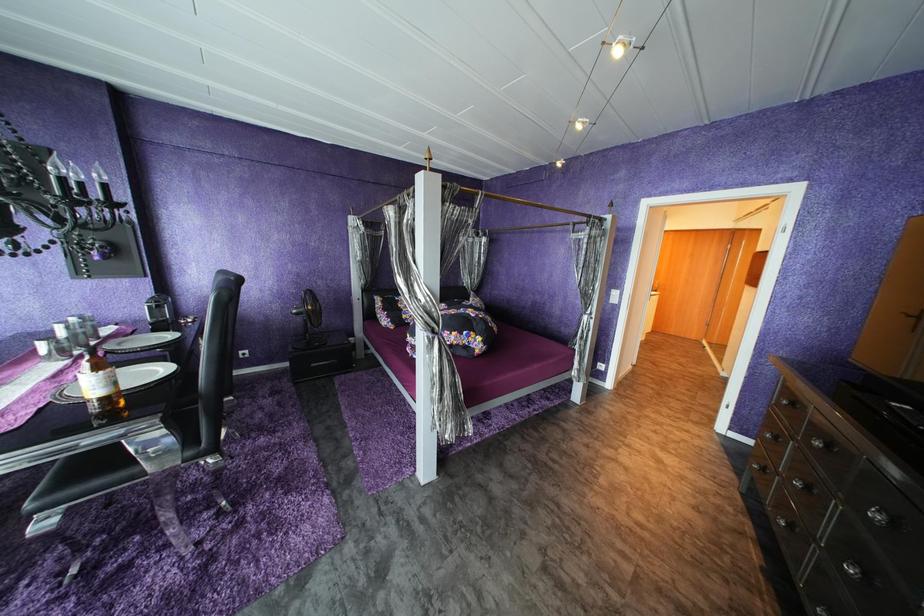
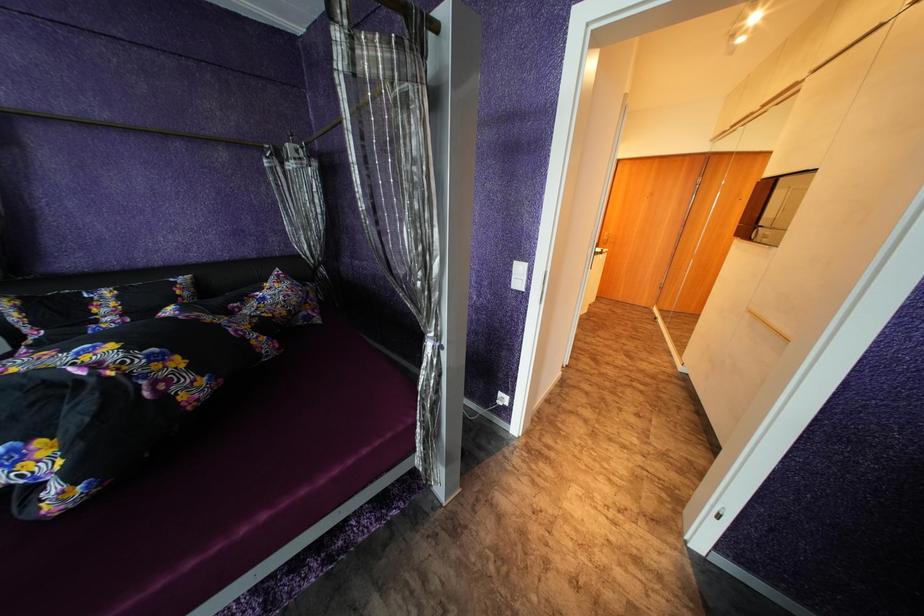
What movement of the cameraman would produce the second image?

The movement direction of the cameraman is right, forward.